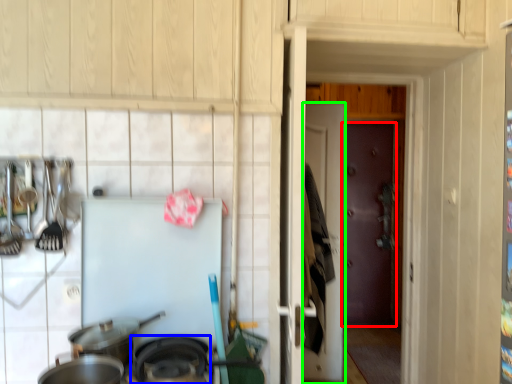
Question: Which is nearer to the door (highlighted by a red box)? wok (highlighted by a blue box) or door (highlighted by a green box).

Choices:
 (A) wok
 (B) door

Answer: (B)